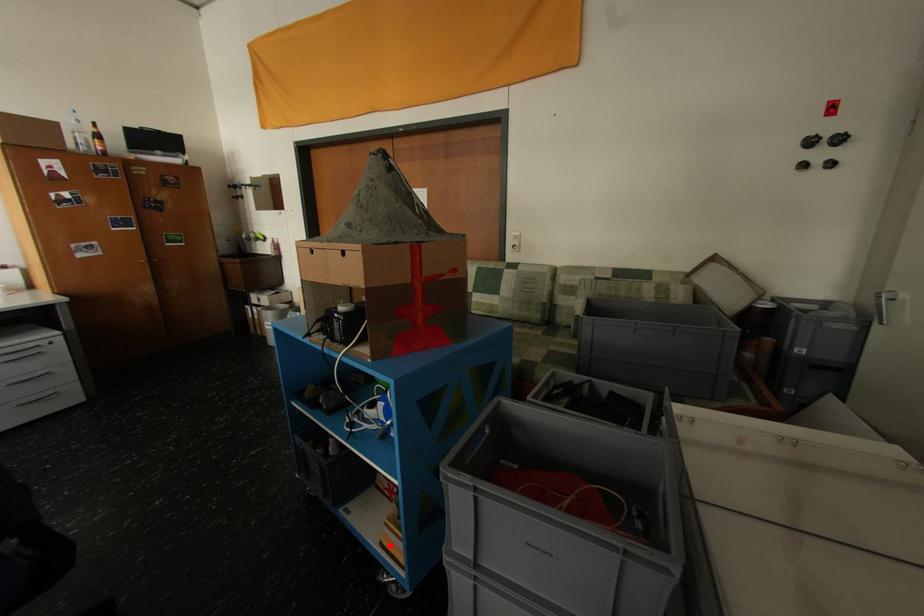
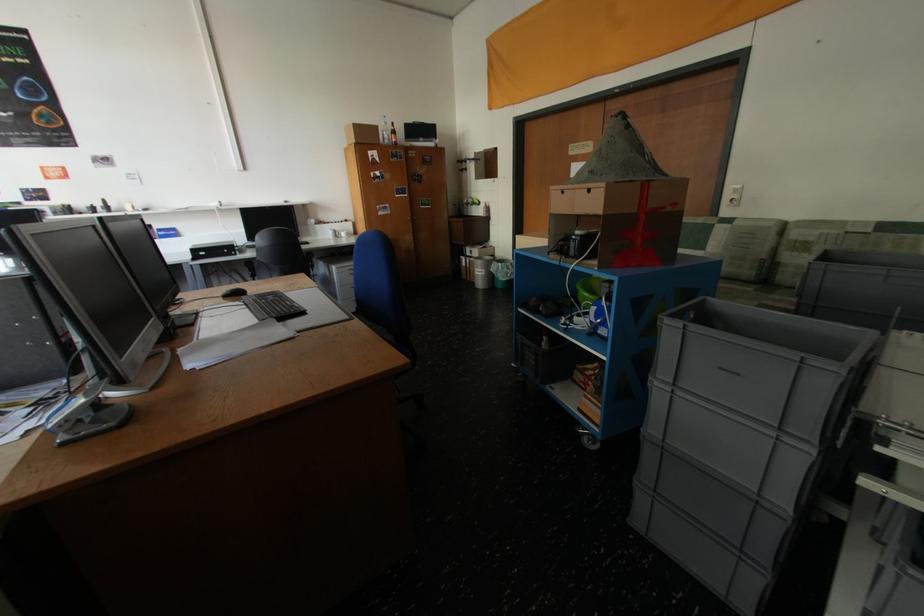
In the second image, find the point that corresponds to the highlighted location in the first image.

(588, 411)